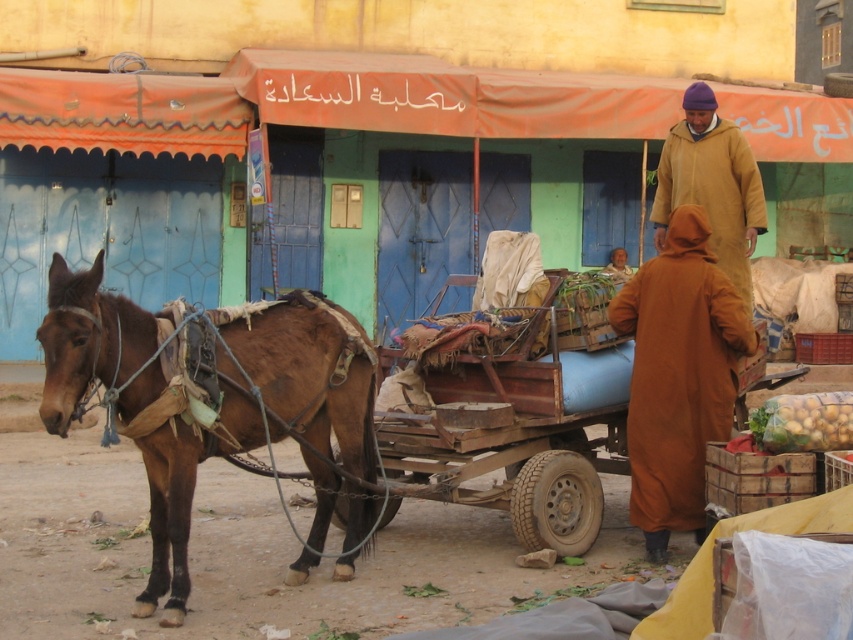
You are a customer in the market and see the brown leather mule at left and the brown woolen robe at center. Which object is positioned more to the left side of the scene?

The brown leather mule at left is positioned more to the left side of the scene than the brown woolen robe at center.

You are standing on the street and see the wooden cart at center and the beige woolen robe at upper right. Which object is positioned higher in the image?

The beige woolen robe at upper right is positioned higher in the image than the wooden cart at center.

You are a customer in the market and you want to approach the cart. You see the brown leather mule at left and the brown woolen robe at center. Which object is closer to the ground?

The brown leather mule at left is below brown woolen robe at center, so the brown leather mule at left is closer to the ground.